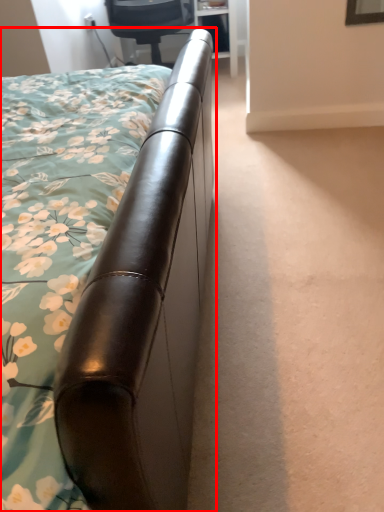
Question: Observing the image, what is the correct spatial positioning of bed (annotated by the red box) in reference to chair?

Choices:
 (A) left
 (B) right

Answer: (A)